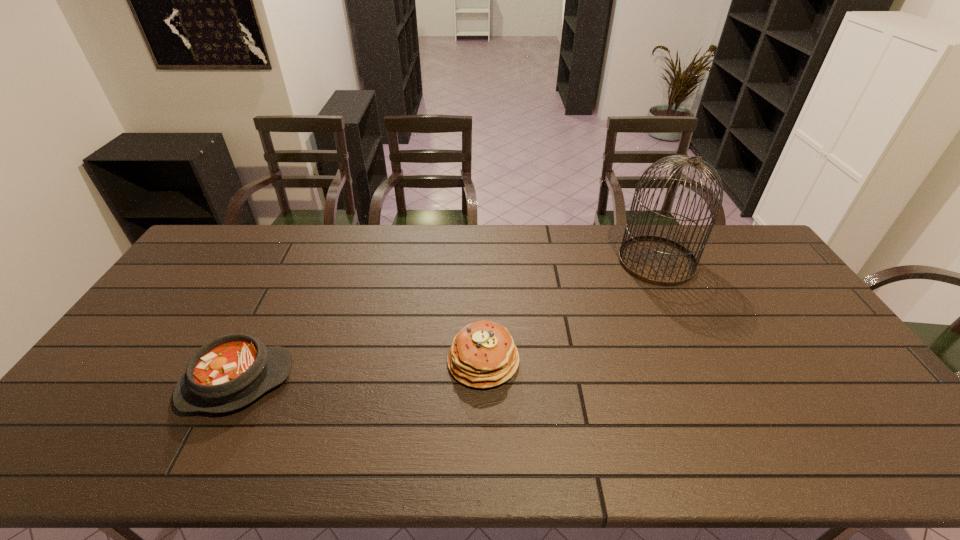
Find the location of a particular element. empty space between the second object from right to left and the casserole is located at coordinates (360, 372).

Where is `free space between the pancake and the tallest object`? This screenshot has width=960, height=540. free space between the pancake and the tallest object is located at coordinates (569, 311).

Where is `blank region between the casserole and the second object from right to left`? blank region between the casserole and the second object from right to left is located at coordinates (360, 372).

Find the location of `free spot between the rightmost object and the second object from left to right`. free spot between the rightmost object and the second object from left to right is located at coordinates (569, 311).

This screenshot has height=540, width=960. What are the coordinates of `object that is the second closest one to the pancake` in the screenshot? It's located at point(656,260).

Locate an element on the screen. The height and width of the screenshot is (540, 960). object that stands as the second closest to the leftmost object is located at coordinates (656, 260).

You are a GUI agent. You are given a task and a screenshot of the screen. Output one action in this format:
    pyautogui.click(x=<x>, y=<y>)
    Task: Click on the free space that satisfies the following two spatial constraints: 1. on the back side of the pancake; 2. on the left side of the casserole
    This screenshot has width=960, height=540.
    Given the screenshot: What is the action you would take?
    pyautogui.click(x=248, y=361)

Locate an element on the screen. free space that satisfies the following two spatial constraints: 1. on the back side of the second object from right to left; 2. on the right side of the casserole is located at coordinates (248, 361).